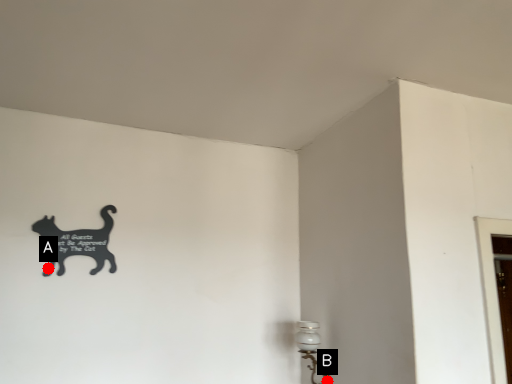
Question: Two points are circled on the image, labeled by A and B beside each circle. Which point is further to the camera?

Choices:
 (A) A is further
 (B) B is further

Answer: (B)